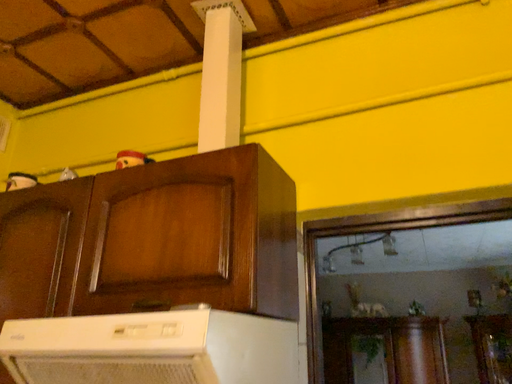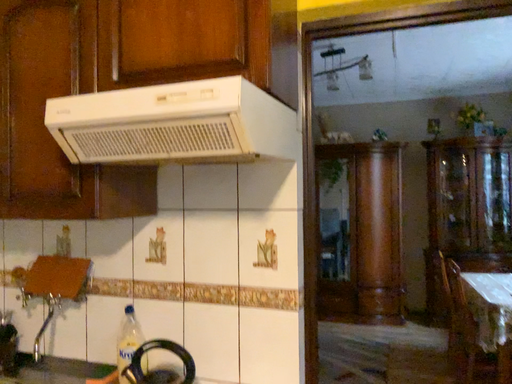
Question: Which way did the camera rotate in the video?

Choices:
 (A) rotated upward
 (B) rotated downward

Answer: (B)